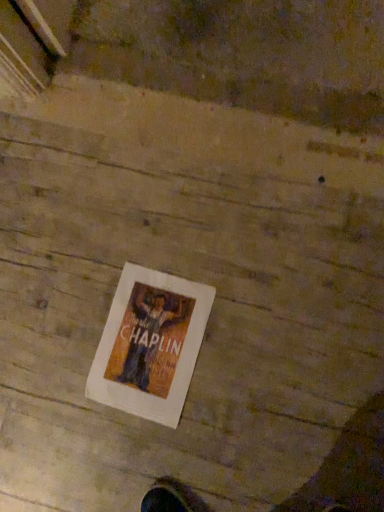
Find the location of `free space to the left of white paper poster at center`. free space to the left of white paper poster at center is located at coordinates (61, 404).